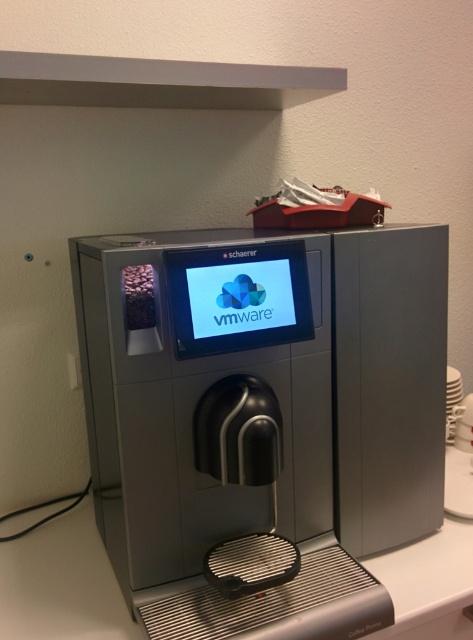
Question: Which point is farther to the camera?

Choices:
 (A) (104, 317)
 (B) (466, 540)

Answer: (B)

Question: Can you confirm if satin silver coffee machine at center is positioned above white glossy counter top at center?

Choices:
 (A) no
 (B) yes

Answer: (B)

Question: Can you confirm if satin silver coffee machine at center is positioned above white glossy counter top at center?

Choices:
 (A) yes
 (B) no

Answer: (A)

Question: Which object is closer to the camera taking this photo?

Choices:
 (A) satin silver coffee machine at center
 (B) white glossy counter top at center

Answer: (A)

Question: Can you confirm if satin silver coffee machine at center is positioned below white glossy counter top at center?

Choices:
 (A) yes
 (B) no

Answer: (B)